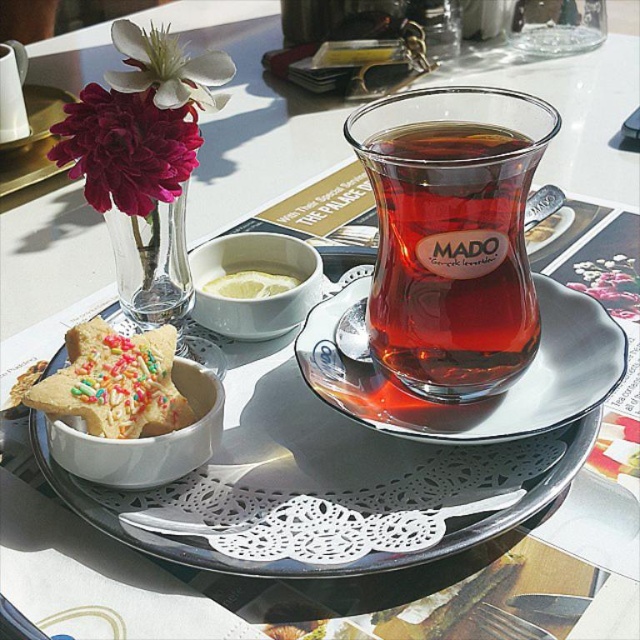
You are arranging flowers for a special event and need to place the clear glass vase at upper left and the pink fabric flower at upper center. According to the scene, where should you position the clear glass vase relative to the pink fabric flower?

The clear glass vase at upper left should be placed over the pink fabric flower at upper center as shown in the scene.

You are organizing a tea party and need to place the sprinkled cookie at center and the pink fabric flower at upper center on a small tray. Which item should you place first if you want to ensure both fit without overlapping?

The sprinkled cookie at center has a larger width than the pink fabric flower at upper center, so you should place the sprinkled cookie at center first to ensure there is enough space for both items on the tray.

You are a guest at a tea ceremony and need to place your napkin. The napkin is 0.3 meters wide. Can you place it at point (152, 262) without overlapping the clear glass vase at upper left?

The clear glass vase at upper left is located at point (152, 262). Placing the napkin there would overlap with the vase, so it is not possible.